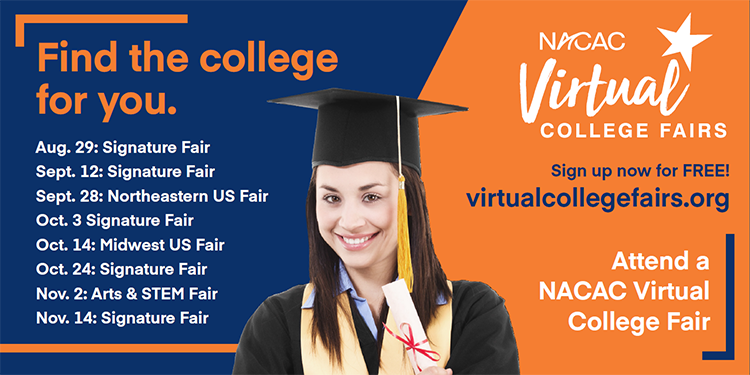
Identify the location of diploma. The width and height of the screenshot is (750, 375). (415, 330).